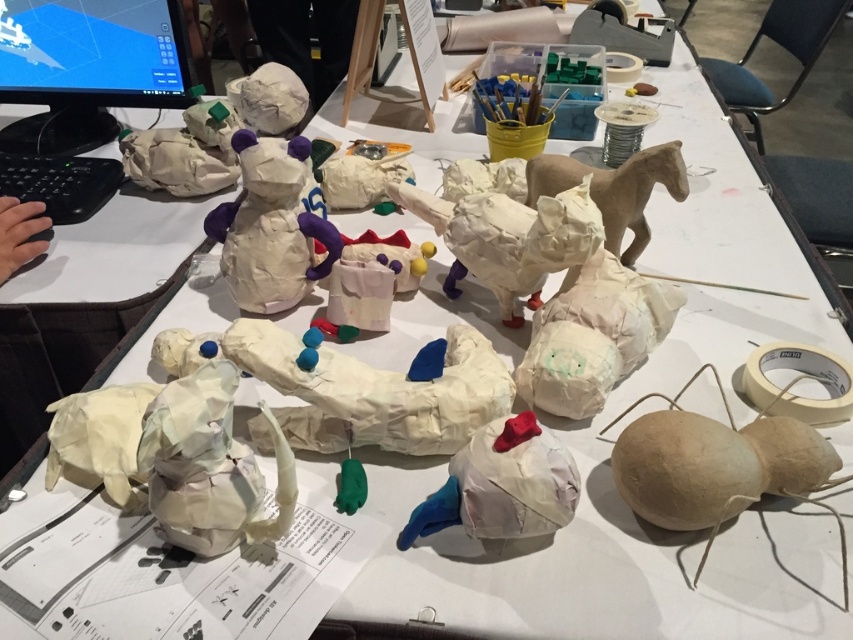
You are an artist who wants to take a photo of the white crumpled paper dog at center and the matte brown spider at lower right. To ensure both are fully visible in the frame, should you adjust your camera angle to focus more on the foreground or background?

You should focus on the foreground because the white crumpled paper dog at center is in front of the matte brown spider at lower right. Adjusting the camera angle to prioritize the foreground will ensure both sculptures are in clear view without one blocking the other.

You are an artist trying to arrange the white crumpled paper dog at center and the matte brown spider at lower right on a shelf. If the shelf has limited space, which sculpture should you choose to fit better?

The white crumpled paper dog at center occupies less space than the matte brown spider at lower right, so it would fit better on the shelf with limited space.

You are an artist trying to arrange your sculptures for a photo shoot. You have a matte brown spider at lower right and a white crumpled paper horse at center. Which sculpture should you choose if you want to place a small decorative item next to it without overwhelming the composition?

The matte brown spider at lower right has a smaller size compared to the white crumpled paper horse at center, so it would be better to place the small decorative item next to the matte brown spider at lower right to avoid overwhelming the composition.